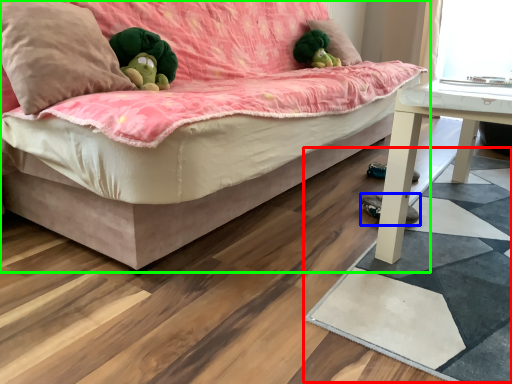
Question: Which object is the farthest from mat (highlighted by a red box)? Choose among these: footwear (highlighted by a blue box) or studio couch (highlighted by a green box).

Choices:
 (A) footwear
 (B) studio couch

Answer: (B)